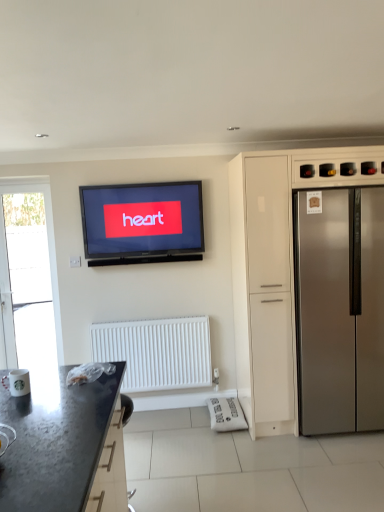
I want to click on blank space situated above black granite countertop at lower left (from a real-world perspective), so [x=44, y=421].